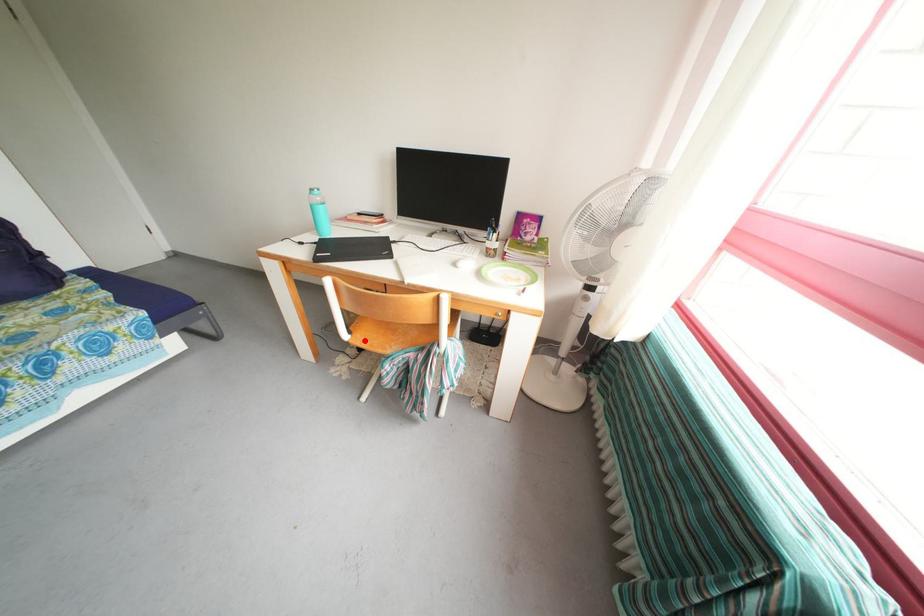
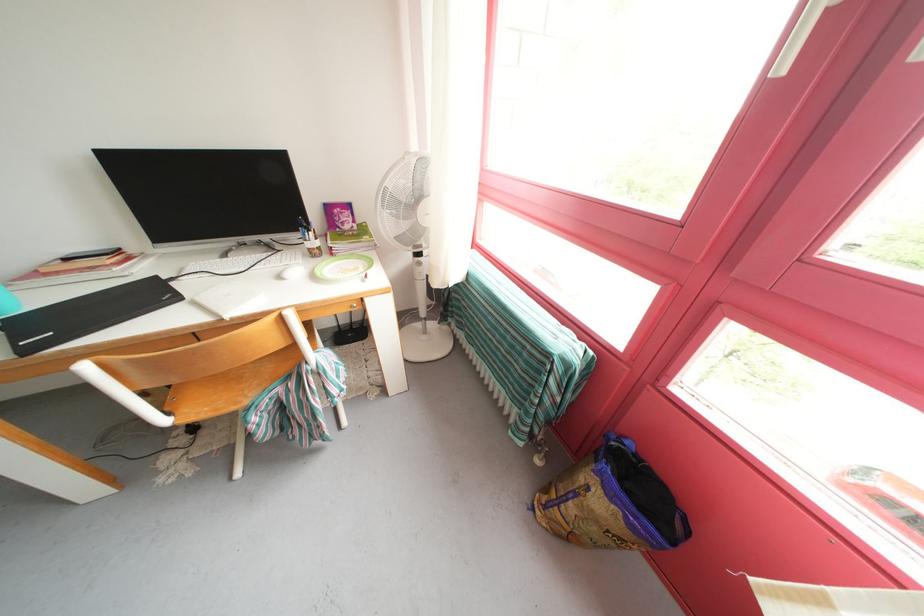
Locate, in the second image, the point that corresponds to the highlighted location in the first image.

(191, 416)